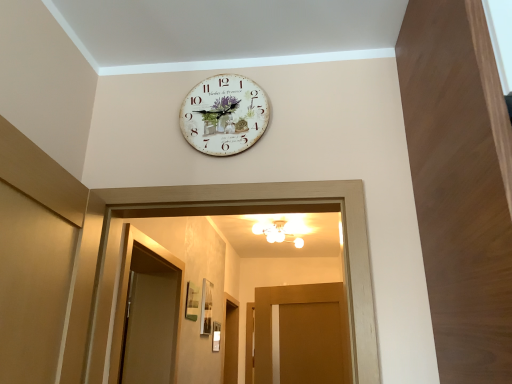
Question: From a real-world perspective, is white painted wood clock at upper center on top of white glossy chandelier at upper center?

Choices:
 (A) yes
 (B) no

Answer: (B)

Question: Considering the relative positions of white painted wood clock at upper center and white glossy chandelier at upper center in the image provided, is white painted wood clock at upper center in front of white glossy chandelier at upper center?

Choices:
 (A) yes
 (B) no

Answer: (A)

Question: Is white painted wood clock at upper center looking in the opposite direction of white glossy chandelier at upper center?

Choices:
 (A) no
 (B) yes

Answer: (B)

Question: Is white painted wood clock at upper center surrounding white glossy chandelier at upper center?

Choices:
 (A) yes
 (B) no

Answer: (B)

Question: From a real-world perspective, is white painted wood clock at upper center physically below white glossy chandelier at upper center?

Choices:
 (A) yes
 (B) no

Answer: (A)

Question: Considering the positions of white glossy chandelier at upper center and white painted wood clock at upper center in the image, is white glossy chandelier at upper center wider or thinner than white painted wood clock at upper center?

Choices:
 (A) wide
 (B) thin

Answer: (A)

Question: Is point (257, 230) positioned closer to the camera than point (233, 104)?

Choices:
 (A) farther
 (B) closer

Answer: (A)

Question: From a real-world perspective, is white glossy chandelier at upper center above or below white painted wood clock at upper center?

Choices:
 (A) below
 (B) above

Answer: (B)

Question: Considering their positions, is white glossy chandelier at upper center located in front of or behind white painted wood clock at upper center?

Choices:
 (A) behind
 (B) front

Answer: (A)

Question: Considering the positions of point (201, 99) and point (296, 243), is point (201, 99) closer or farther from the camera than point (296, 243)?

Choices:
 (A) farther
 (B) closer

Answer: (B)

Question: From the image's perspective, relative to white glossy chandelier at upper center, is white painted wood clock at upper center above or below?

Choices:
 (A) above
 (B) below

Answer: (A)

Question: Would you say white painted wood clock at upper center is to the left or to the right of white glossy chandelier at upper center in the picture?

Choices:
 (A) left
 (B) right

Answer: (A)

Question: Is white painted wood clock at upper center situated inside white glossy chandelier at upper center or outside?

Choices:
 (A) inside
 (B) outside

Answer: (B)

Question: Which is correct: white glossy chandelier at upper center is inside matte wood door at center, or outside of it?

Choices:
 (A) outside
 (B) inside

Answer: (A)

Question: From the image's perspective, is white glossy chandelier at upper center positioned above or below matte wood door at center?

Choices:
 (A) below
 (B) above

Answer: (B)